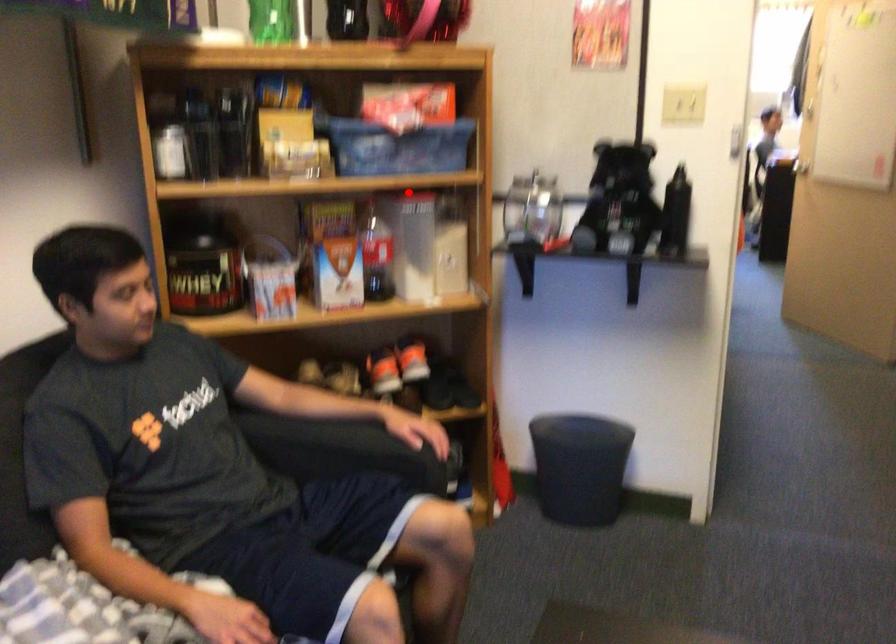
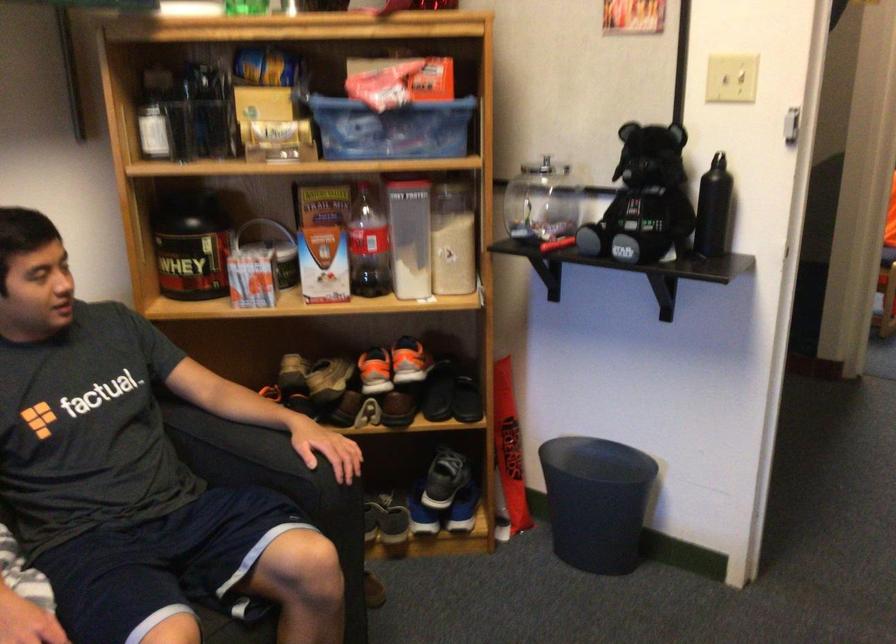
Find the pixel in the second image that matches the highlighted location in the first image.

(405, 178)